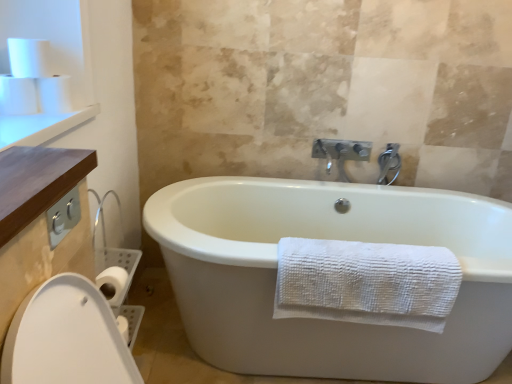
Question: From a real-world perspective, is white matte toilet paper at upper left, which is counted as the third toilet paper, starting from the left, physically below white textured towel at lower center?

Choices:
 (A) no
 (B) yes

Answer: (A)

Question: Is white textured towel at lower center located within white matte toilet paper at upper left, which is the 1th toilet paper from right to left?

Choices:
 (A) yes
 (B) no

Answer: (B)

Question: Does white matte toilet paper at upper left, which is counted as the third toilet paper, starting from the left, come behind white textured towel at lower center?

Choices:
 (A) yes
 (B) no

Answer: (B)

Question: Does white matte toilet paper at upper left, which is the 1th toilet paper from right to left, have a greater width compared to white textured towel at lower center?

Choices:
 (A) no
 (B) yes

Answer: (A)

Question: Considering the relative sizes of white matte toilet paper at upper left, which is counted as the third toilet paper, starting from the left, and white textured towel at lower center in the image provided, is white matte toilet paper at upper left, which is counted as the third toilet paper, starting from the left, smaller than white textured towel at lower center?

Choices:
 (A) no
 (B) yes

Answer: (B)

Question: Is white matte toilet paper at upper left, which is counted as the third toilet paper, starting from the left, not close to white textured towel at lower center?

Choices:
 (A) yes
 (B) no

Answer: (A)

Question: Is white matte toilet paper at upper left, which is counted as the third toilet paper, starting from the left, at the right side of white matte toilet paper at upper left, the 2th toilet paper positioned from the left?

Choices:
 (A) no
 (B) yes

Answer: (B)

Question: From a real-world perspective, is white matte toilet paper at upper left, which is counted as the third toilet paper, starting from the left, positioned under white matte toilet paper at upper left, arranged as the second toilet paper when viewed from the right, based on gravity?

Choices:
 (A) yes
 (B) no

Answer: (A)

Question: Considering the relative sizes of white matte toilet paper at upper left, which is the 1th toilet paper from right to left, and white matte toilet paper at upper left, arranged as the second toilet paper when viewed from the right, in the image provided, is white matte toilet paper at upper left, which is the 1th toilet paper from right to left, bigger than white matte toilet paper at upper left, arranged as the second toilet paper when viewed from the right,?

Choices:
 (A) yes
 (B) no

Answer: (A)

Question: Would you say white matte toilet paper at upper left, which is the 1th toilet paper from right to left, contains white matte toilet paper at upper left, arranged as the second toilet paper when viewed from the right?

Choices:
 (A) yes
 (B) no

Answer: (B)

Question: Is white matte toilet paper at upper left, which is counted as the third toilet paper, starting from the left, to the left of white matte toilet paper at upper left, arranged as the second toilet paper when viewed from the right, from the viewer's perspective?

Choices:
 (A) no
 (B) yes

Answer: (A)

Question: From the image's perspective, does white matte toilet paper at upper left, which is counted as the third toilet paper, starting from the left, appear lower than white matte toilet paper at upper left, arranged as the second toilet paper when viewed from the right?

Choices:
 (A) no
 (B) yes

Answer: (B)

Question: From the image's perspective, does white matte toilet paper at upper left, placed as the third toilet paper when sorted from right to left, appear lower than white matte toilet paper at upper left, which is the 1th toilet paper from right to left?

Choices:
 (A) no
 (B) yes

Answer: (B)